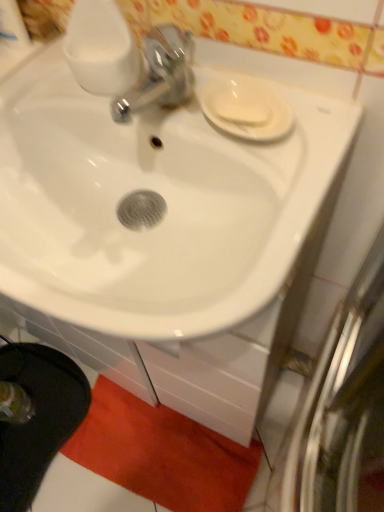
Question: Does orange plush bath mat at lower center turn towards white matte soap at upper right?

Choices:
 (A) no
 (B) yes

Answer: (A)

Question: Does orange plush bath mat at lower center have a lesser width compared to white matte soap at upper right?

Choices:
 (A) yes
 (B) no

Answer: (B)

Question: Does orange plush bath mat at lower center have a greater width compared to white matte soap at upper right?

Choices:
 (A) yes
 (B) no

Answer: (A)

Question: Is orange plush bath mat at lower center far from white matte soap at upper right?

Choices:
 (A) yes
 (B) no

Answer: (B)

Question: Can you confirm if orange plush bath mat at lower center is shorter than white matte soap at upper right?

Choices:
 (A) no
 (B) yes

Answer: (A)

Question: In terms of height, does orange plush bath mat at lower center look taller or shorter compared to white glossy sink at center?

Choices:
 (A) short
 (B) tall

Answer: (A)

Question: Would you say orange plush bath mat at lower center is inside or outside white glossy sink at center?

Choices:
 (A) outside
 (B) inside

Answer: (A)

Question: From the image's perspective, is orange plush bath mat at lower center located above or below white glossy sink at center?

Choices:
 (A) above
 (B) below

Answer: (B)

Question: Is orange plush bath mat at lower center wider or thinner than white glossy sink at center?

Choices:
 (A) wide
 (B) thin

Answer: (B)

Question: Based on their sizes in the image, would you say orange plush bath mat at lower center is bigger or smaller than white glossy saucer at upper right?

Choices:
 (A) small
 (B) big

Answer: (B)

Question: From a real-world perspective, is orange plush bath mat at lower center physically located above or below white glossy saucer at upper right?

Choices:
 (A) below
 (B) above

Answer: (A)

Question: Considering the positions of point (x=150, y=448) and point (x=228, y=133), is point (x=150, y=448) closer or farther from the camera than point (x=228, y=133)?

Choices:
 (A) farther
 (B) closer

Answer: (A)

Question: Based on their positions, is orange plush bath mat at lower center located to the left or right of white glossy saucer at upper right?

Choices:
 (A) right
 (B) left

Answer: (B)

Question: Is white glossy saucer at upper right situated inside orange plush bath mat at lower center or outside?

Choices:
 (A) outside
 (B) inside

Answer: (A)

Question: In terms of height, does white glossy saucer at upper right look taller or shorter compared to orange plush bath mat at lower center?

Choices:
 (A) short
 (B) tall

Answer: (A)